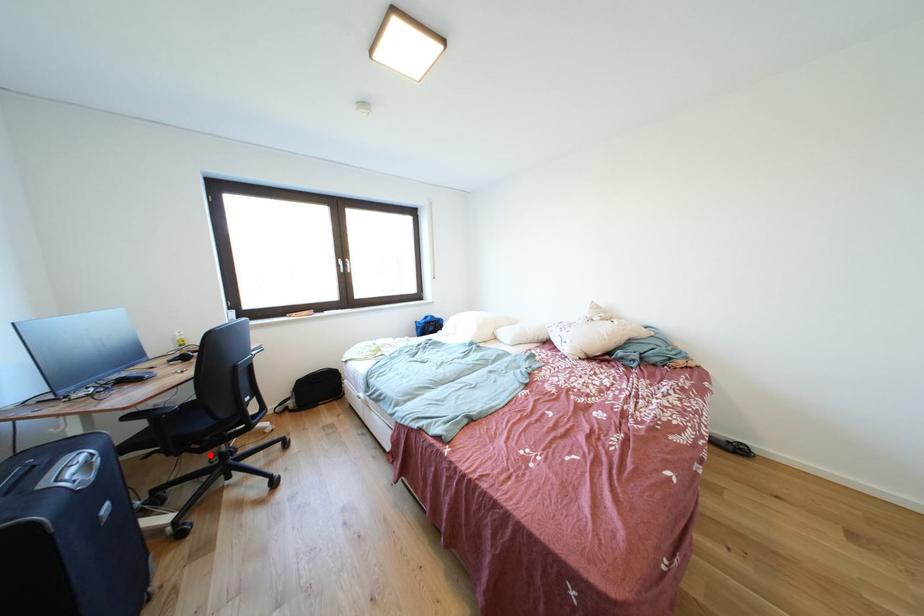
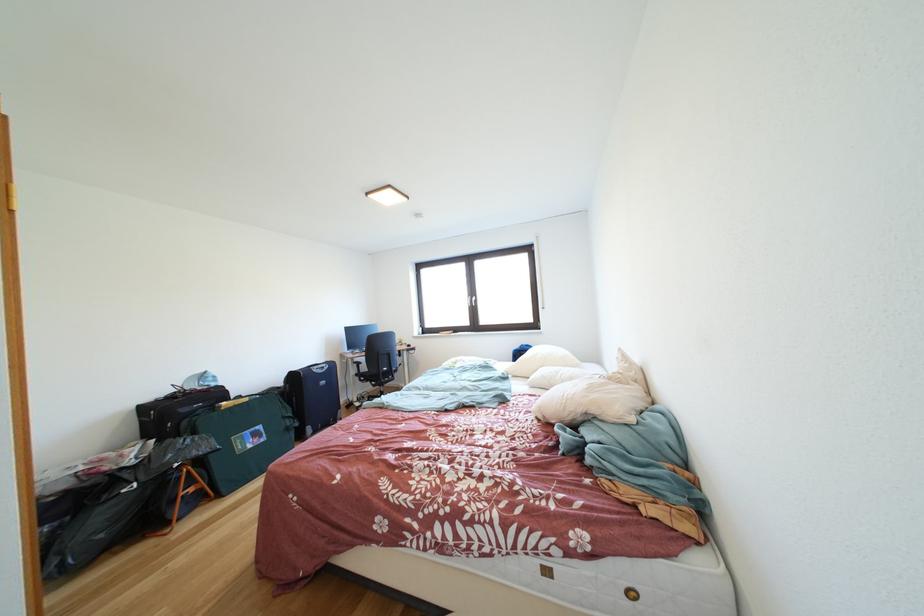
Question: I am providing you with two images of the same scene from different viewpoints. A red point is shown in image1. For the corresponding object point in image2, is it positioned nearer or farther from the camera?

Choices:
 (A) Nearer
 (B) Farther

Answer: (B)